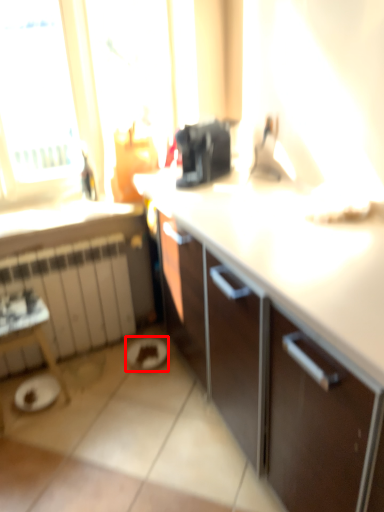
Question: Observing the image, what is the correct spatial positioning of manhole (annotated by the red box) in reference to radiator?

Choices:
 (A) left
 (B) right

Answer: (B)